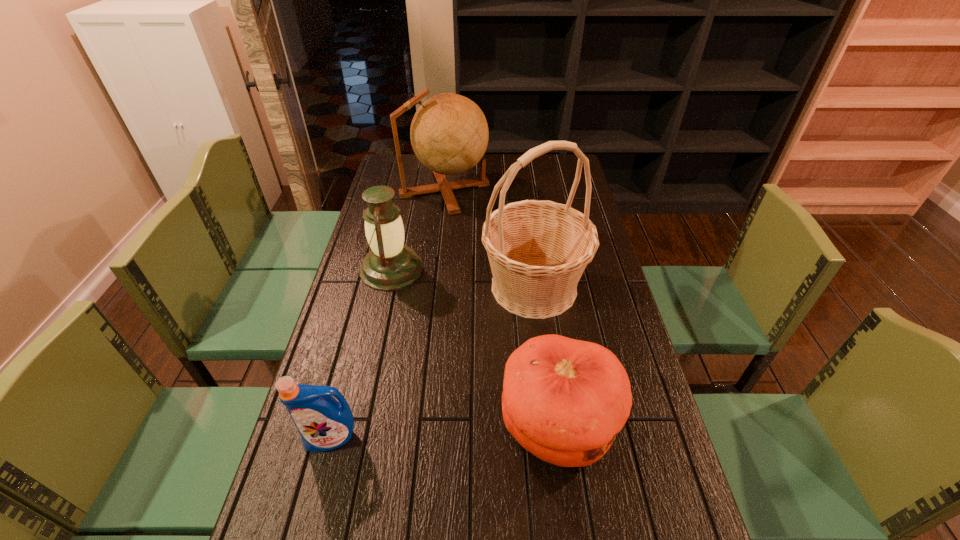
I want to click on free region that satisfies the following two spatial constraints: 1. with the light compartment facing forward on the third shortest object; 2. on the left side of the pumpkin, so click(357, 426).

Find the location of a particular element. This screenshot has width=960, height=540. blank space that satisfies the following two spatial constraints: 1. with the light compartment facing forward on the lantern; 2. on the label of the detergent is located at coordinates (354, 438).

Locate an element on the screen. The image size is (960, 540). free spot that satisfies the following two spatial constraints: 1. with the light compartment facing forward on the pumpkin; 2. on the right side of the lantern is located at coordinates (357, 426).

This screenshot has width=960, height=540. I want to click on free location that satisfies the following two spatial constraints: 1. on the surface of the second tallest object; 2. on the right side of the tallest object, so click(x=434, y=287).

Locate an element on the screen. The width and height of the screenshot is (960, 540). free space that satisfies the following two spatial constraints: 1. with the light compartment facing forward on the pumpkin; 2. on the right side of the lantern is located at coordinates (357, 426).

The width and height of the screenshot is (960, 540). In order to click on vacant space that satisfies the following two spatial constraints: 1. on the surface of the globe; 2. on the left side of the pumpkin in this screenshot , I will do `click(419, 426)`.

This screenshot has width=960, height=540. I want to click on vacant region that satisfies the following two spatial constraints: 1. with the light compartment facing forward on the third tallest object; 2. on the back side of the basket, so click(388, 287).

This screenshot has width=960, height=540. Identify the location of vacant region that satisfies the following two spatial constraints: 1. on the surface of the fourth shortest object; 2. on the label of the detergent. click(x=418, y=438).

Where is `free space that satisfies the following two spatial constraints: 1. on the back side of the tallest object; 2. on the surface of the globe`? Image resolution: width=960 pixels, height=540 pixels. free space that satisfies the following two spatial constraints: 1. on the back side of the tallest object; 2. on the surface of the globe is located at coordinates (521, 190).

Identify the location of vacant space that satisfies the following two spatial constraints: 1. on the surface of the fourth shortest object; 2. on the label of the detergent. The height and width of the screenshot is (540, 960). (418, 438).